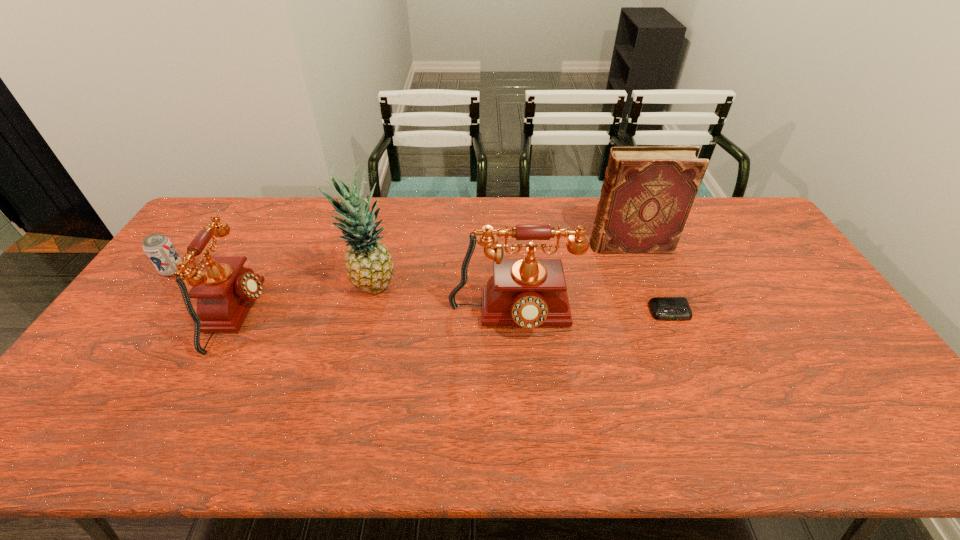
Where is `free space located on the dial of the taller telephone`? free space located on the dial of the taller telephone is located at coordinates (516, 386).

Where is `vacant space located 0.250m on the back of the beer can`? The image size is (960, 540). vacant space located 0.250m on the back of the beer can is located at coordinates (212, 217).

This screenshot has height=540, width=960. I want to click on free space located 0.080m on the back of the fourth object from right to left, so click(381, 253).

You are a GUI agent. You are given a task and a screenshot of the screen. Output one action in this format:
    pyautogui.click(x=<x>, y=<y>)
    Task: Click on the vacant region located on the spine side of the hardback book
    The width and height of the screenshot is (960, 540).
    Given the screenshot: What is the action you would take?
    pyautogui.click(x=473, y=246)

Identify the location of vacant space located on the spine side of the hardback book. (533, 246).

I want to click on vacant space situated 0.210m on the spine side of the hardback book, so click(527, 246).

Where is `vacant space situated on the display of the shortest object`? vacant space situated on the display of the shortest object is located at coordinates (695, 373).

Where is `object that is at the far edge`? This screenshot has width=960, height=540. object that is at the far edge is located at coordinates (648, 191).

Find the location of `object positioned at the left edge`. object positioned at the left edge is located at coordinates (159, 249).

The width and height of the screenshot is (960, 540). I want to click on vacant area at the far edge of the desktop, so click(466, 199).